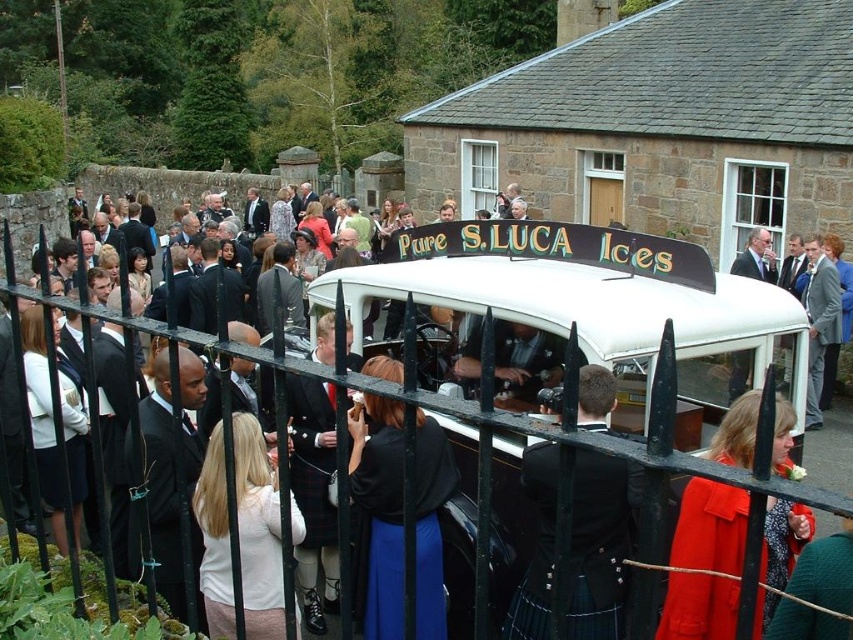
You are a photographer standing behind the black wrought iron fence and want to capture a photo of both the black suit at center and the matte black kilt at center. Which of the two requires more space in the frame to fully capture its width?

The black suit at center requires more space in the frame to fully capture its width since its width is larger than the matte black kilt at center.

You are a photographer standing behind the black wrought iron fence. You want to take a photo of both the black leather kilt at center and the red wool coat at center. Which one will appear larger in the photo?

The black leather kilt at center will appear larger in the photo because it is taller than the red wool coat at center.